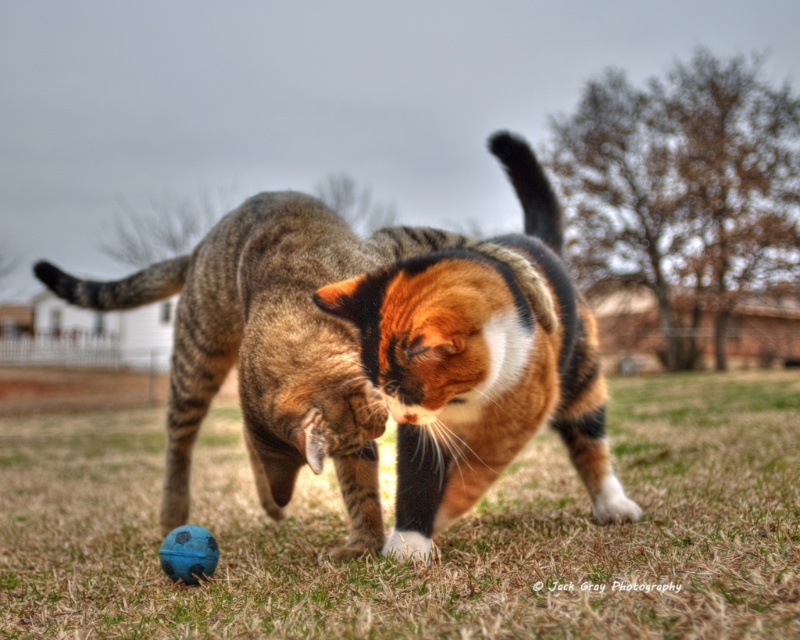
Question: Can you confirm if green grass at center is thinner than calico fur cat at center?

Choices:
 (A) no
 (B) yes

Answer: (A)

Question: Estimate the real-world distances between objects in this image. Which object is farther from the calico fur cat at center?

Choices:
 (A) green grass at center
 (B) blue rubber ball at lower left

Answer: (A)

Question: Which object is positioned farthest from the calico fur cat at center?

Choices:
 (A) green grass at center
 (B) blue rubber ball at lower left

Answer: (A)

Question: Does calico fur cat at center have a larger size compared to blue rubber ball at lower left?

Choices:
 (A) no
 (B) yes

Answer: (B)

Question: Where is green grass at center located in relation to blue rubber ball at lower left in the image?

Choices:
 (A) right
 (B) left

Answer: (A)

Question: Among these points, which one is nearest to the camera?

Choices:
 (A) (x=49, y=440)
 (B) (x=176, y=554)

Answer: (B)